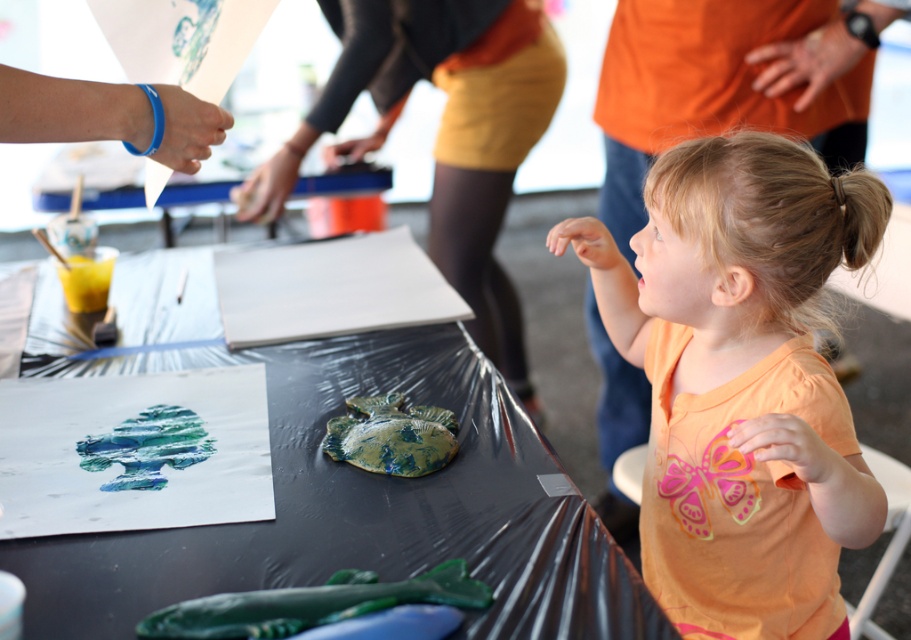
In the scene shown: Is blue rubber bracelet at upper left to the right of green clay fish at center from the viewer's perspective?

In fact, blue rubber bracelet at upper left is to the left of green clay fish at center.

Who is higher up, blue rubber bracelet at upper left or green clay fish at center?

blue rubber bracelet at upper left

The width and height of the screenshot is (911, 640). Identify the location of blue rubber bracelet at upper left. (70, 109).

Can you confirm if shiny plastic table at center is smaller than green textured clay turtle at center?

Incorrect, shiny plastic table at center is not smaller in size than green textured clay turtle at center.

Does point (32, 545) lie behind point (396, 432)?

No, it is not.

Find the location of a particular element. Image resolution: width=911 pixels, height=640 pixels. shiny plastic table at center is located at coordinates (345, 497).

Can you confirm if matte yellow skirt at center is positioned below watercolor painting at center?

Incorrect, matte yellow skirt at center is not positioned below watercolor painting at center.

Does matte yellow skirt at center have a lesser height compared to watercolor painting at center?

In fact, matte yellow skirt at center may be taller than watercolor painting at center.

Is point (479, 256) less distant than point (159, 458)?

No, (479, 256) is further to viewer.

Where is `matte yellow skirt at center`? The width and height of the screenshot is (911, 640). matte yellow skirt at center is located at coordinates (444, 134).